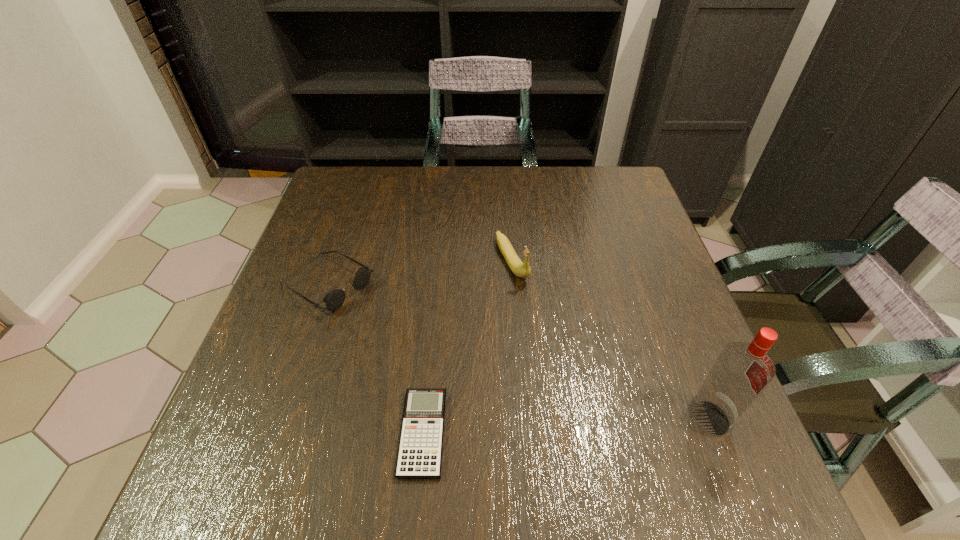
Where is `free space located 0.160m on the front-facing side of the leftmost object`? free space located 0.160m on the front-facing side of the leftmost object is located at coordinates (418, 337).

Image resolution: width=960 pixels, height=540 pixels. I want to click on vacant space located on the front-facing side of the leftmost object, so click(452, 358).

Locate an element on the screen. The height and width of the screenshot is (540, 960). free space located 0.310m at the stem of the third shortest object is located at coordinates (587, 400).

Find the location of a particular element. free location located at the stem of the third shortest object is located at coordinates (550, 338).

Identify the location of free space located 0.240m at the stem of the third shortest object. This screenshot has width=960, height=540. (568, 369).

Locate an element on the screen. The height and width of the screenshot is (540, 960). calculator located in the near edge section of the desktop is located at coordinates (420, 449).

Identify the location of vodka that is at the near edge. (742, 371).

You are a GUI agent. You are given a task and a screenshot of the screen. Output one action in this format:
    pyautogui.click(x=<x>, y=<y>)
    Task: Click on the object situated at the left edge
    
    Given the screenshot: What is the action you would take?
    pyautogui.click(x=334, y=299)

Image resolution: width=960 pixels, height=540 pixels. In order to click on object located at the right edge in this screenshot , I will do `click(742, 371)`.

This screenshot has width=960, height=540. What are the coordinates of `object that is at the near right corner` in the screenshot? It's located at (742, 371).